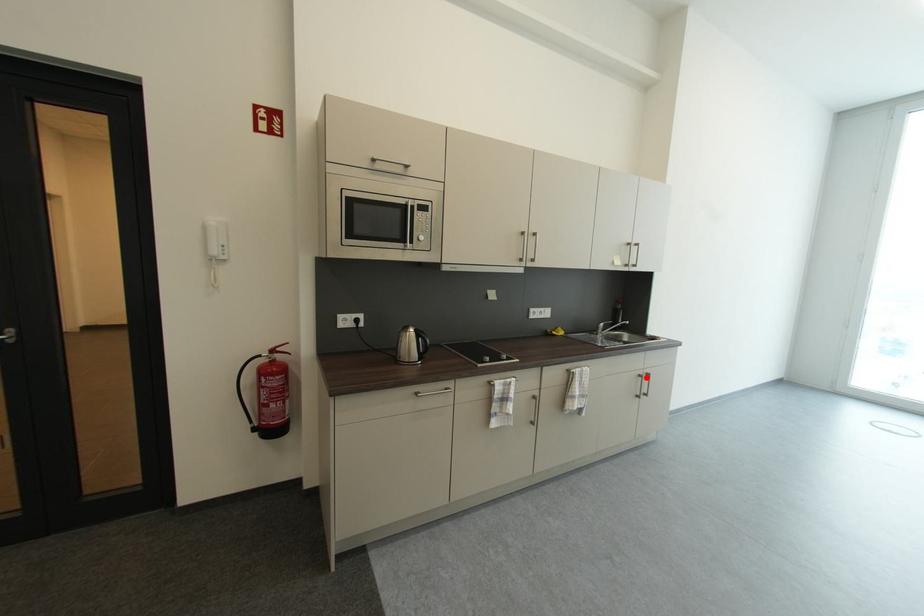
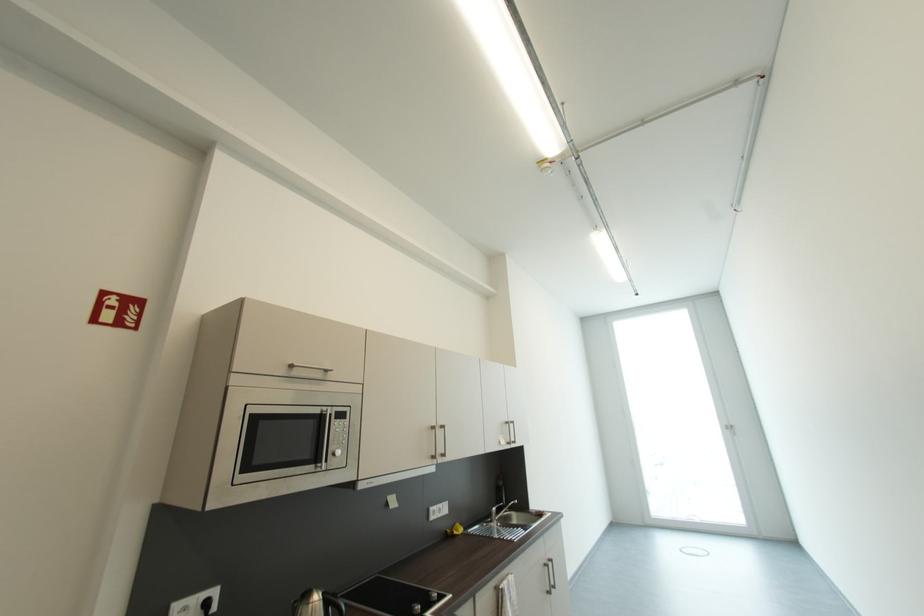
Question: I am providing you with two images of the same scene from different viewpoints. A red point is shown in image1. For the corresponding object point in image2, is it positioned nearer or farther from the camera?

Choices:
 (A) Nearer
 (B) Farther

Answer: (A)